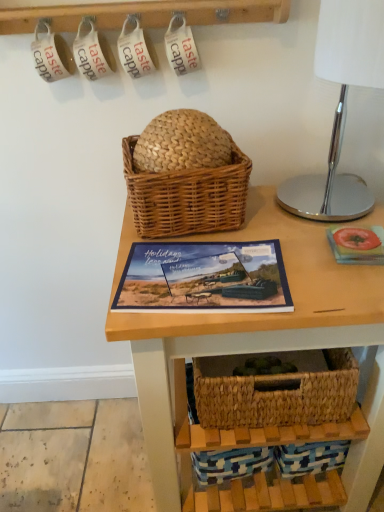
What are the coordinates of `vacant space to the right of woven brown picnic basket at center` in the screenshot? It's located at (278, 221).